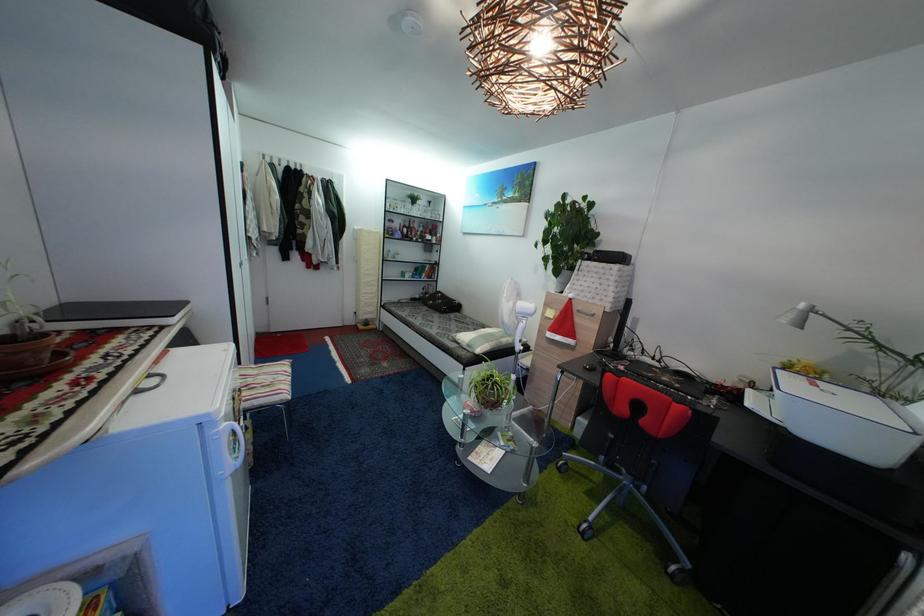
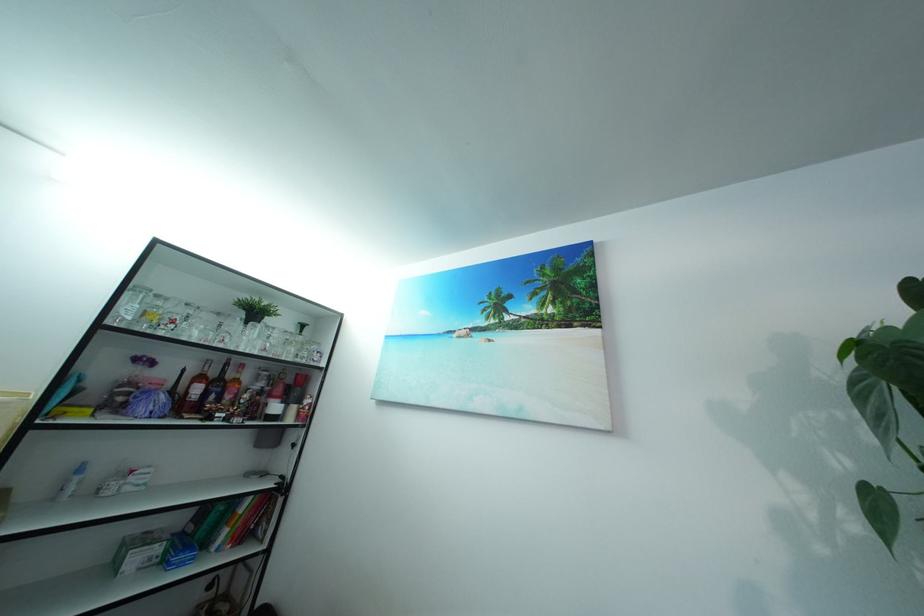
Find the pixel in the second image that matches (x=416, y=233) in the first image.

(222, 381)